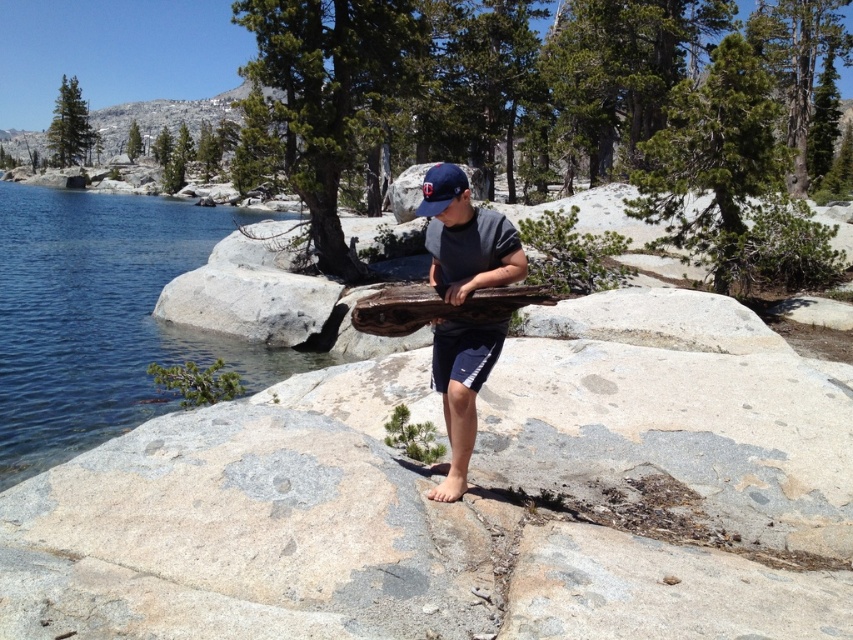
Question: Which point is closer to the camera?

Choices:
 (A) weathered wood at center
 (B) matte blue baseball cap at center
 (C) matte brown wood at center
 (D) clear blue water at left

Answer: (C)

Question: Is matte brown wood at center thinner than matte blue baseball cap at center?

Choices:
 (A) yes
 (B) no

Answer: (B)

Question: Can you confirm if clear blue water at left is positioned to the right of matte brown wood at center?

Choices:
 (A) yes
 (B) no

Answer: (B)

Question: Which of the following is the closest to the observer?

Choices:
 (A) (465, 397)
 (B) (442, 189)
 (C) (184, 248)
 (D) (474, 292)

Answer: (B)

Question: Observing the image, what is the correct spatial positioning of clear blue water at left in reference to matte blue baseball cap at center?

Choices:
 (A) left
 (B) right

Answer: (A)

Question: Which point appears closest to the camera in this image?

Choices:
 (A) (473, 369)
 (B) (28, 205)
 (C) (393, 321)

Answer: (A)